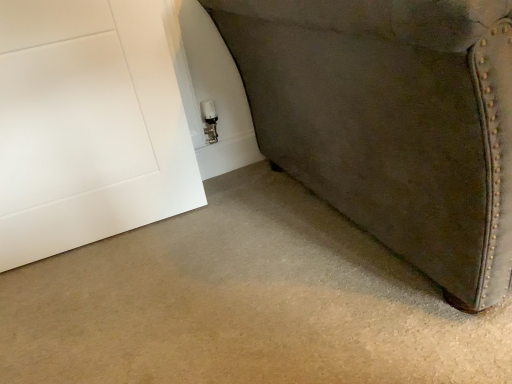
The width and height of the screenshot is (512, 384). What are the coordinates of `velvet green armchair at right` in the screenshot? It's located at (392, 121).

Image resolution: width=512 pixels, height=384 pixels. What do you see at coordinates (392, 121) in the screenshot? I see `velvet green armchair at right` at bounding box center [392, 121].

Where is `velvet green armchair at right`? The image size is (512, 384). velvet green armchair at right is located at coordinates (392, 121).